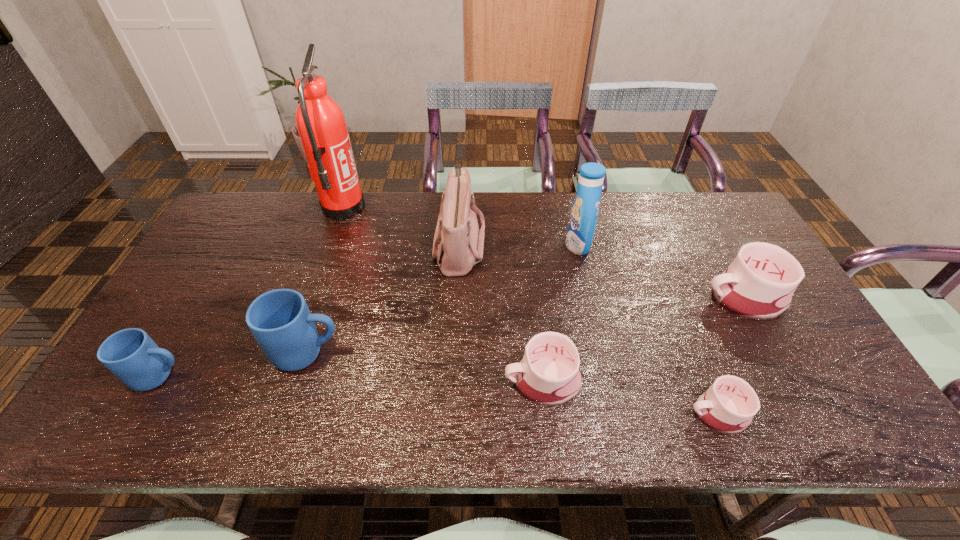
Identify the location of the leftmost white mug. The width and height of the screenshot is (960, 540). (548, 375).

Find the location of `the second shortest mug`. the second shortest mug is located at coordinates (548, 375).

The height and width of the screenshot is (540, 960). I want to click on the second white mug from right to left, so click(x=728, y=406).

You are a GUI agent. You are given a task and a screenshot of the screen. Output one action in this format:
    pyautogui.click(x=<x>, y=<y>)
    Task: Click on the shortest object
    
    Given the screenshot: What is the action you would take?
    pyautogui.click(x=728, y=406)

In order to click on free space located 0.380m on the label side of the fire extinguisher in this screenshot , I will do `click(475, 208)`.

Locate an element on the screen. The height and width of the screenshot is (540, 960). vacant area situated on the front-facing side of the second tallest object is located at coordinates (515, 245).

The width and height of the screenshot is (960, 540). Identify the location of free region located on the front-facing side of the second tallest object. (447, 245).

Find the location of `vacant space located on the front-facing side of the second tallest object`. vacant space located on the front-facing side of the second tallest object is located at coordinates (x=547, y=245).

The width and height of the screenshot is (960, 540). Find the location of `vacant space positioned on the front pocket of the shoulder bag`. vacant space positioned on the front pocket of the shoulder bag is located at coordinates (552, 244).

The width and height of the screenshot is (960, 540). In order to click on vacant region located on the side of the right blue mug with the handle in this screenshot , I will do `click(461, 353)`.